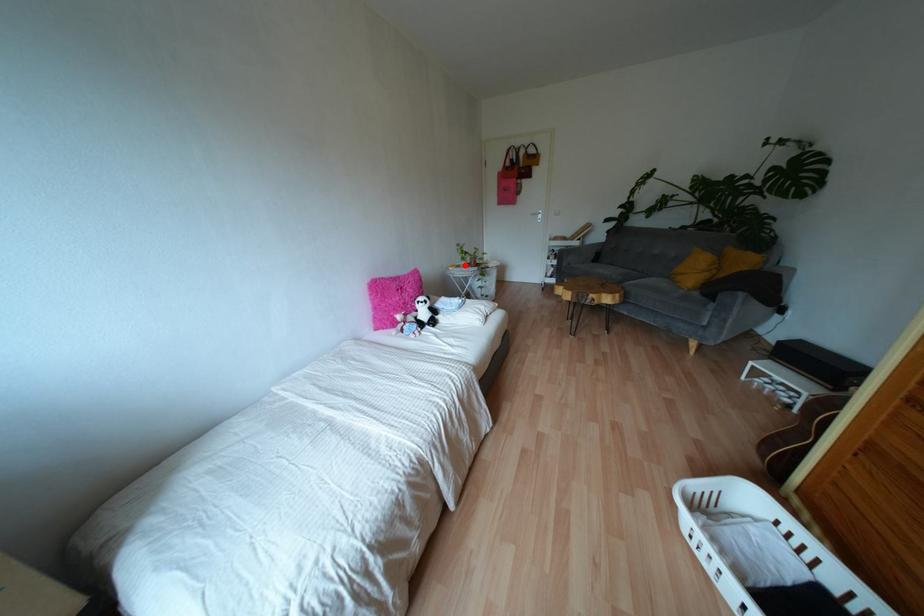
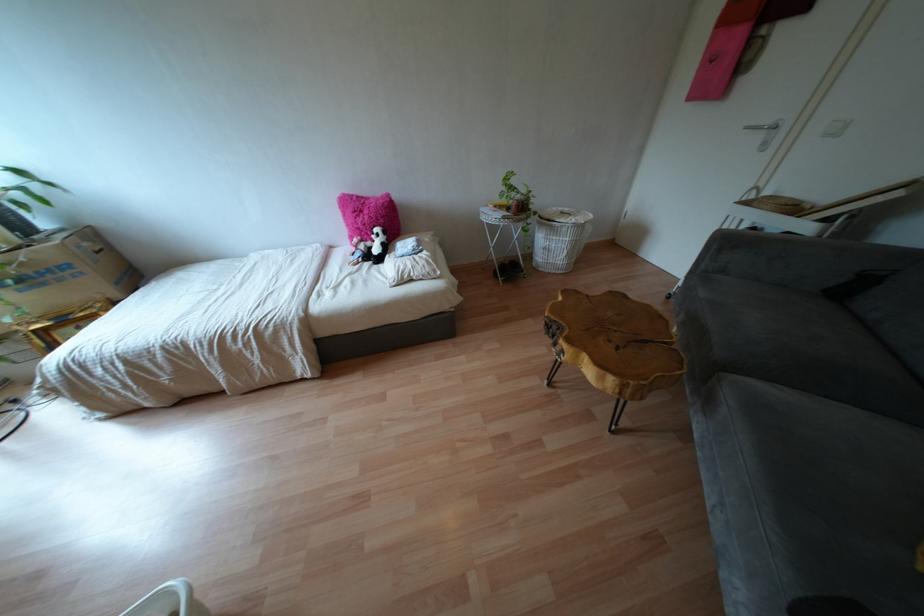
Question: I am providing you with two images of the same scene from different viewpoints. Image1 has a red point marked. In image2, the corresponding 3D location appears at what relative position? Reply with the corresponding letter.

Choices:
 (A) Closer
 (B) Farther

Answer: (B)